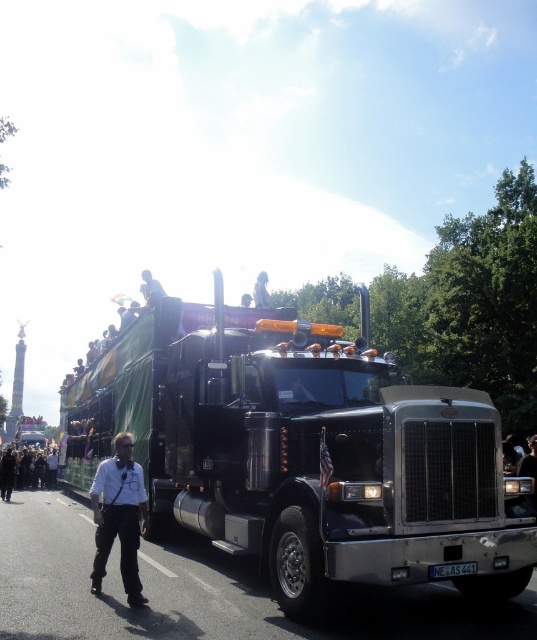
You are a photographer positioned at the origin point of the image coordinate system. You want to capture a photo of the shiny black truck at center. What are the coordinates where you should aim your camera?

The coordinates where you should aim your camera are at point (x=303, y=452).

You are a pedestrian standing on the sidewalk and see the shiny black truck at center and the dark gray pants at lower left. Which object is closer to you?

The dark gray pants at lower left are closer to you because the shiny black truck at center is positioned over it, indicating it is further away.